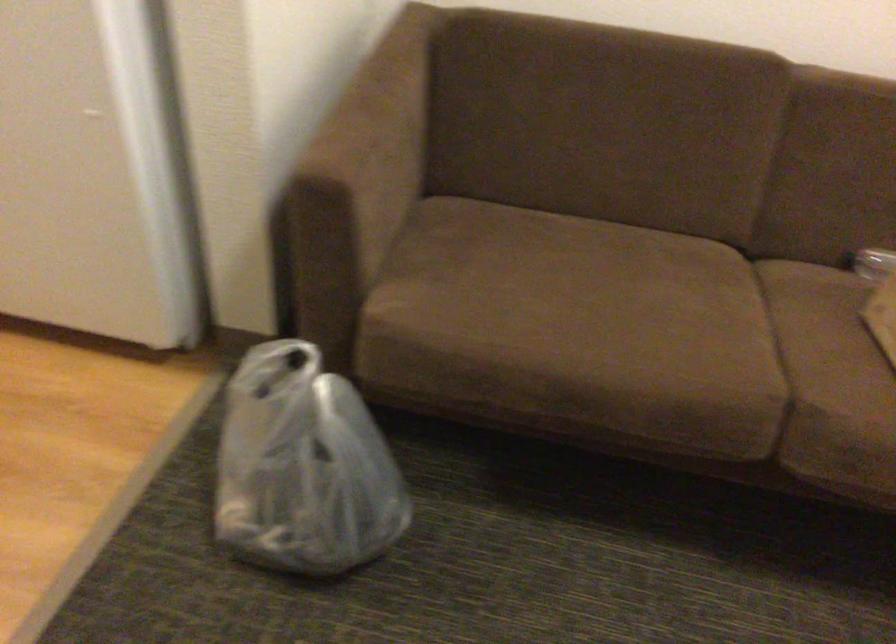
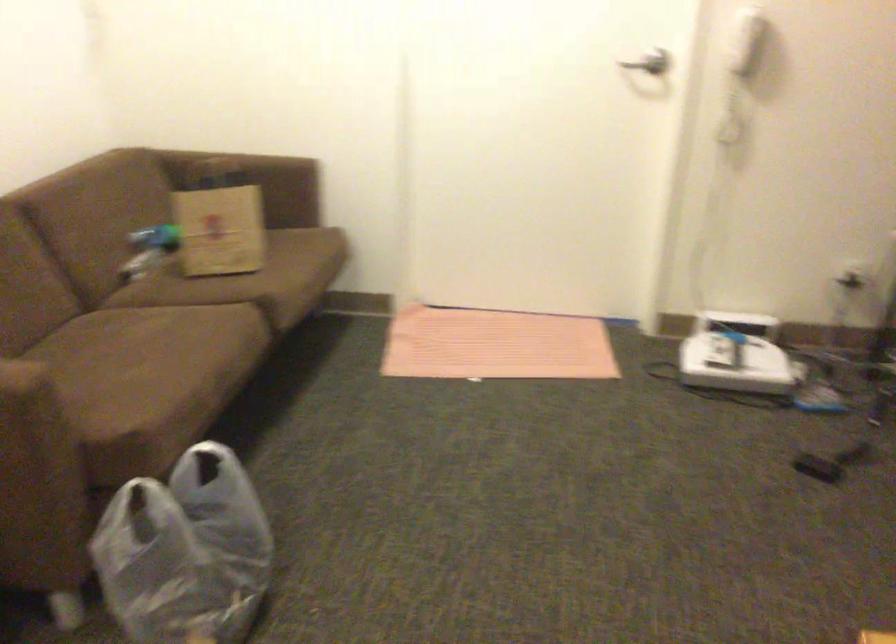
Find the pixel in the second image that matches point 746,111 in the first image.

(23, 242)